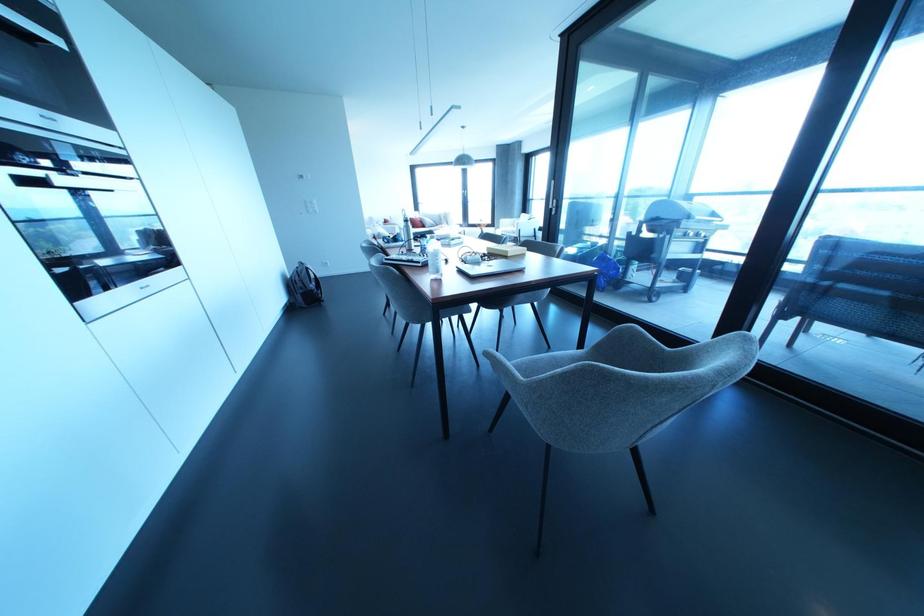
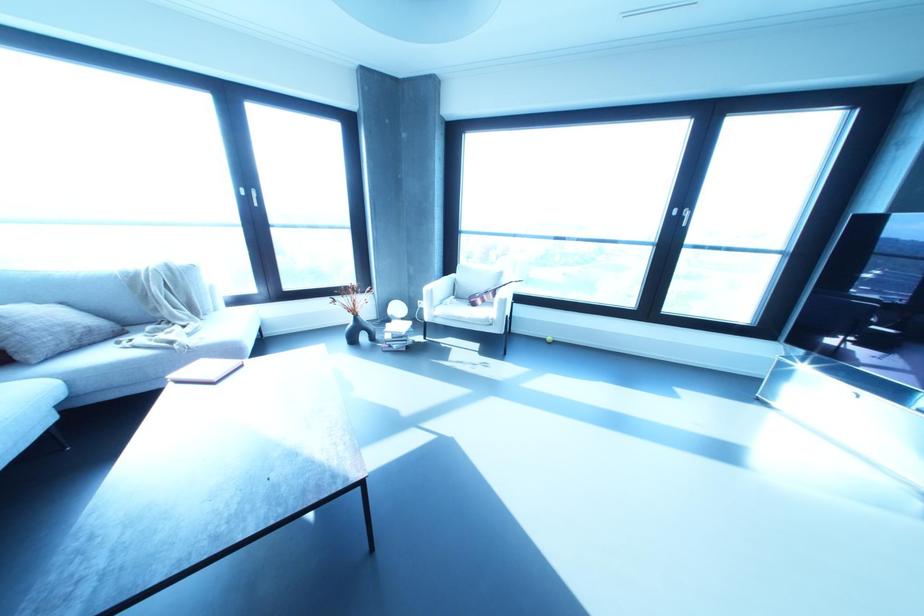
Where in the second image is the point corresponding to point 500,220 from the first image?

(426, 288)